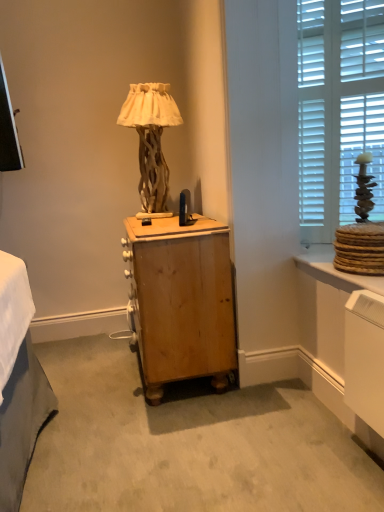
Where is `free region on the left part of matte wood vanity at lower right`? free region on the left part of matte wood vanity at lower right is located at coordinates pos(261,428).